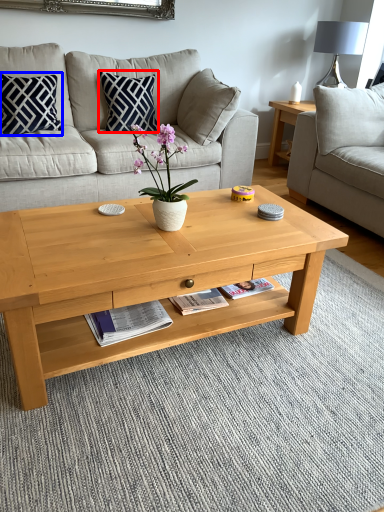
Question: Which of the following is the farthest to the observer, pillow (highlighted by a red box) or pillow (highlighted by a blue box)?

Choices:
 (A) pillow
 (B) pillow

Answer: (A)